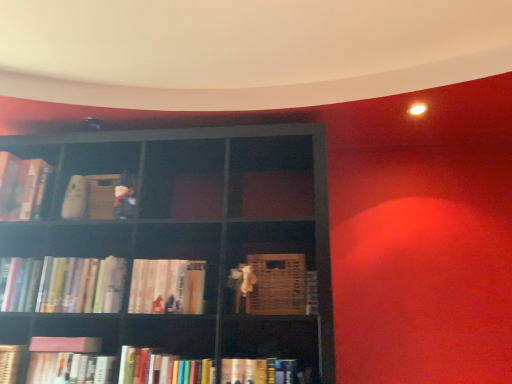
What do you see at coordinates (66, 344) in the screenshot? I see `pink matte book at lower left, the fourth book positioned from the left` at bounding box center [66, 344].

Identify the location of hardcover books at center, the 7th book from the left. (167, 287).

Find the location of a particular element. Image resolution: width=512 pixels, height=384 pixels. hardcover book at left, arranged as the first book when viewed from the left is located at coordinates (21, 187).

What's the angular difference between hardcover books at lower center, the third book positioned from the right, and hardcover books at center, the 4th book positioned from the right,'s facing directions?

There is a 2.97-degree angle between the facing directions of hardcover books at lower center, the third book positioned from the right, and hardcover books at center, the 4th book positioned from the right.

Which is in front, hardcover books at lower center, positioned as the 8th book in left-to-right order, or hardcover books at center, the 4th book positioned from the right?

Positioned in front is hardcover books at lower center, positioned as the 8th book in left-to-right order.

Does point (149, 378) appear closer or farther from the camera than point (198, 284)?

Point (149, 378) is closer to the camera than point (198, 284).

From the picture: From the image's perspective, is hardcover books at lower center, the third book positioned from the right, beneath hardcover books at center, the 4th book positioned from the right?

Yes, from the image's perspective, hardcover books at lower center, the third book positioned from the right, is beneath hardcover books at center, the 4th book positioned from the right.

From the image's perspective, is wooden crate at center, arranged as the tenth book when viewed from the left, located above or below hardcover book at lower center, the ninth book in the left-to-right sequence?

From the image's perspective, wooden crate at center, arranged as the tenth book when viewed from the left, appears above hardcover book at lower center, the ninth book in the left-to-right sequence.

Which object is positioned more to the right, wooden crate at center, arranged as the tenth book when viewed from the left, or hardcover book at lower center, which ranks as the second book in right-to-left order?

wooden crate at center, arranged as the tenth book when viewed from the left.

From a real-world perspective, which object stands above the other?

wooden crate at center, arranged as the tenth book when viewed from the left, is physically above.

Which book is the 7th one when counting from the back of the hardcover book at lower center, which ranks as the second book in right-to-left order? Please provide its 2D coordinates.

[(273, 285)]

Consider the image. Is hardcover books at left, arranged as the 6th book when viewed from the left, positioned beyond the bounds of hardcover book at lower center, which ranks as the second book in right-to-left order?

Indeed, hardcover books at left, arranged as the 6th book when viewed from the left, is completely outside hardcover book at lower center, which ranks as the second book in right-to-left order.

In the image, is hardcover books at left, arranged as the 6th book when viewed from the left, positioned in front of or behind hardcover book at lower center, the ninth book in the left-to-right sequence?

hardcover books at left, arranged as the 6th book when viewed from the left, is positioned farther from the viewer than hardcover book at lower center, the ninth book in the left-to-right sequence.

Is hardcover books at left, arranged as the 6th book when viewed from the left, positioned far away from hardcover book at lower center, which ranks as the second book in right-to-left order?

hardcover books at left, arranged as the 6th book when viewed from the left, is actually quite close to hardcover book at lower center, which ranks as the second book in right-to-left order.

Is hardcover book at lower center, the ninth book in the left-to-right sequence, at the back of hardcover books at left, the fifth book viewed from the right?

No.

How different are the orientations of hardcover book at left, arranged as the first book when viewed from the left, and hardcover books at left, acting as the eighth book starting from the right, in degrees?

The angular difference between hardcover book at left, arranged as the first book when viewed from the left, and hardcover books at left, acting as the eighth book starting from the right, is 1.43 degrees.

Who is taller, hardcover book at left, arranged as the first book when viewed from the left, or hardcover books at left, which ranks as the 3th book in left-to-right order?

Standing taller between the two is hardcover book at left, arranged as the first book when viewed from the left.

Could you tell me if hardcover book at left, arranged as the first book when viewed from the left, is turned towards hardcover books at left, which ranks as the 3th book in left-to-right order?

No, hardcover book at left, arranged as the first book when viewed from the left, is not facing towards hardcover books at left, which ranks as the 3th book in left-to-right order.

Is hardcover book at lower center, the ninth book in the left-to-right sequence, at the right side of hardcover book at left, arranged as the first book when viewed from the left?

Correct, you'll find hardcover book at lower center, the ninth book in the left-to-right sequence, to the right of hardcover book at left, arranged as the first book when viewed from the left.

The image size is (512, 384). Find the location of `the 9th book behind the hardcover book at lower center, the ninth book in the left-to-right sequence, starting your count from the anchor`. the 9th book behind the hardcover book at lower center, the ninth book in the left-to-right sequence, starting your count from the anchor is located at coordinates pos(21,187).

Can you confirm if hardcover book at lower center, the ninth book in the left-to-right sequence, is bigger than hardcover book at left, arranged as the first book when viewed from the left?

Actually, hardcover book at lower center, the ninth book in the left-to-right sequence, might be smaller than hardcover book at left, arranged as the first book when viewed from the left.

Which object is closer to the camera taking this photo, hardcover book at lower center, the ninth book in the left-to-right sequence, or hardcover book at left, which is the 10th book in right-to-left order?

hardcover book at lower center, the ninth book in the left-to-right sequence.

The width and height of the screenshot is (512, 384). Identify the location of the 4th book behind the hardcover book at lower center, the ninth book in the left-to-right sequence, starting your count from the anchor. (66, 344).

Which point is more distant from viewer, [256,369] or [69,349]?

The point [69,349] is farther from the camera.

Is hardcover book at lower center, the ninth book in the left-to-right sequence, positioned beyond the bounds of pink matte book at lower left, acting as the 7th book starting from the right?

That's correct, hardcover book at lower center, the ninth book in the left-to-right sequence, is outside of pink matte book at lower left, acting as the 7th book starting from the right.

From a real-world perspective, is hardcover book at lower center, the ninth book in the left-to-right sequence, located beneath pink matte book at lower left, the fourth book positioned from the left?

Yes, from a real-world perspective, hardcover book at lower center, the ninth book in the left-to-right sequence, is below pink matte book at lower left, the fourth book positioned from the left.

Which of these two, wooden crate at center, the first book viewed from the right, or hardcover book at left, arranged as the first book when viewed from the left, is wider?

With larger width is hardcover book at left, arranged as the first book when viewed from the left.

From the image's perspective, is wooden crate at center, the first book viewed from the right, located above or below hardcover book at left, arranged as the first book when viewed from the left?

wooden crate at center, the first book viewed from the right, is situated lower than hardcover book at left, arranged as the first book when viewed from the left, in the image.

Would you say wooden crate at center, the first book viewed from the right, is to the left or to the right of hardcover book at left, which is the 10th book in right-to-left order, in the picture?

wooden crate at center, the first book viewed from the right, is positioned on hardcover book at left, which is the 10th book in right-to-left order,'s right side.

Is wooden crate at center, the first book viewed from the right, completely or partially outside of hardcover book at left, arranged as the first book when viewed from the left?

wooden crate at center, the first book viewed from the right, is positioned outside hardcover book at left, arranged as the first book when viewed from the left.

Where is `the 5th book below the hardcover books at center, the 4th book positioned from the right (from the image's perspective)`? This screenshot has height=384, width=512. the 5th book below the hardcover books at center, the 4th book positioned from the right (from the image's perspective) is located at coordinates (162, 368).

This screenshot has width=512, height=384. Find the location of `the 1st book to the left when counting from the wooden crate at center, the first book viewed from the right`. the 1st book to the left when counting from the wooden crate at center, the first book viewed from the right is located at coordinates (258, 371).

When comparing their distances from hardcover book at lower center, which ranks as the second book in right-to-left order, does wooden crate at center, the first book viewed from the right, or hardcover books at lower center, the third book positioned from the right, seem further?

The object further to hardcover book at lower center, which ranks as the second book in right-to-left order, is wooden crate at center, the first book viewed from the right.

Consider the image. Looking at the image, which one is located further to pink matte book at lower left, the fourth book positioned from the left, hardcover book at left, arranged as the first book when viewed from the left, or wooden crate at center, arranged as the tenth book when viewed from the left?

wooden crate at center, arranged as the tenth book when viewed from the left, is further to pink matte book at lower left, the fourth book positioned from the left.

Based on their spatial positions, is pink matte book at lower left, acting as the 7th book starting from the right, or wooden crate at center, the first book viewed from the right, further from hardcover book at lower left, acting as the 6th book starting from the right?

The object further to hardcover book at lower left, acting as the 6th book starting from the right, is wooden crate at center, the first book viewed from the right.

Based on their spatial positions, is hardcover book at lower left, placed as the ninth book when sorted from right to left, or hardcover books at left, arranged as the 6th book when viewed from the left, further from hardcover books at lower center, the third book positioned from the right?

→ Among the two, hardcover book at lower left, placed as the ninth book when sorted from right to left, is located further to hardcover books at lower center, the third book positioned from the right.

Estimate the real-world distances between objects in this image. Which object is closer to hardcover books at lower center, positioned as the 8th book in left-to-right order, hardcover books at left, arranged as the 6th book when viewed from the left, or hardcover book at lower center, the ninth book in the left-to-right sequence?

Based on the image, hardcover book at lower center, the ninth book in the left-to-right sequence, appears to be nearer to hardcover books at lower center, positioned as the 8th book in left-to-right order.

Estimate the real-world distances between objects in this image. Which object is closer to hardcover book at lower left, placed as the ninth book when sorted from right to left, wooden crate at center, arranged as the tenth book when viewed from the left, or hardcover book at left, which is the 10th book in right-to-left order?

Based on the image, hardcover book at left, which is the 10th book in right-to-left order, appears to be nearer to hardcover book at lower left, placed as the ninth book when sorted from right to left.

Based on the photo, considering their positions, is hardcover books at left, acting as the eighth book starting from the right, positioned further to hardcover books at left, arranged as the 6th book when viewed from the left, than hardcover books at center, the 4th book positioned from the right?

hardcover books at center, the 4th book positioned from the right, is further to hardcover books at left, arranged as the 6th book when viewed from the left.

Looking at the image, which one is located further to wooden crate at center, the first book viewed from the right, hardcover book at lower center, the ninth book in the left-to-right sequence, or hardcover book at left, which is the 10th book in right-to-left order?

hardcover book at left, which is the 10th book in right-to-left order, is positioned further to the anchor wooden crate at center, the first book viewed from the right.

You are a GUI agent. You are given a task and a screenshot of the screen. Output one action in this format:
    pyautogui.click(x=<x>, y=<y>)
    Task: Click on the book between hardcover books at center, the 7th book from the left, and hardcover book at lower center, which ranks as the second book in right-to-left order, in the horizontal direction
    Image resolution: width=512 pixels, height=384 pixels.
    Given the screenshot: What is the action you would take?
    pyautogui.click(x=162, y=368)

The image size is (512, 384). In order to click on book located between hardcover books at left, which ranks as the 3th book in left-to-right order, and hardcover book at lower left, acting as the 6th book starting from the right, in the left-right direction in this screenshot , I will do `click(66, 344)`.

Identify the location of book located between hardcover books at left, the fifth book viewed from the right, and hardcover books at lower center, positioned as the 8th book in left-to-right order, in the left-right direction. Image resolution: width=512 pixels, height=384 pixels. (167, 287).

Where is `book between hardcover books at lower center, positioned as the 8th book in left-to-right order, and wooden crate at center, the first book viewed from the right, in the horizontal direction`? The height and width of the screenshot is (384, 512). book between hardcover books at lower center, positioned as the 8th book in left-to-right order, and wooden crate at center, the first book viewed from the right, in the horizontal direction is located at coordinates (258, 371).